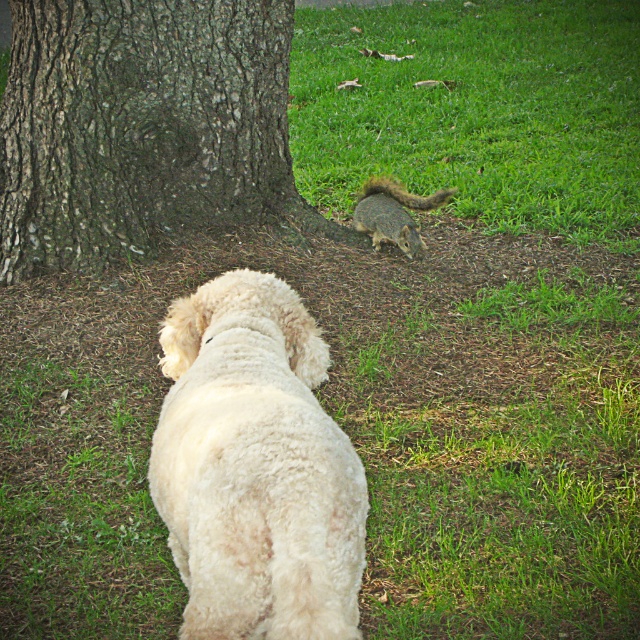
Question: Can you confirm if dark brown bark tree at center is positioned to the left of gray-furred squirrel at lower center?

Choices:
 (A) no
 (B) yes

Answer: (B)

Question: Is gray-furred squirrel at lower center to the right of brown furry tail at lower center from the viewer's perspective?

Choices:
 (A) yes
 (B) no

Answer: (B)

Question: Based on their relative distances, which object is farther from the gray-furred squirrel at lower center?

Choices:
 (A) dark brown bark tree at center
 (B) brown furry tail at lower center
 (C) white fluffy dog at center

Answer: (C)

Question: Is dark brown bark tree at center bigger than white fluffy dog at center?

Choices:
 (A) yes
 (B) no

Answer: (A)

Question: Which point is farther from the camera taking this photo?

Choices:
 (A) (445, 202)
 (B) (385, 227)

Answer: (A)

Question: Which point is closer to the camera taking this photo?

Choices:
 (A) (419, 198)
 (B) (243, 13)

Answer: (B)